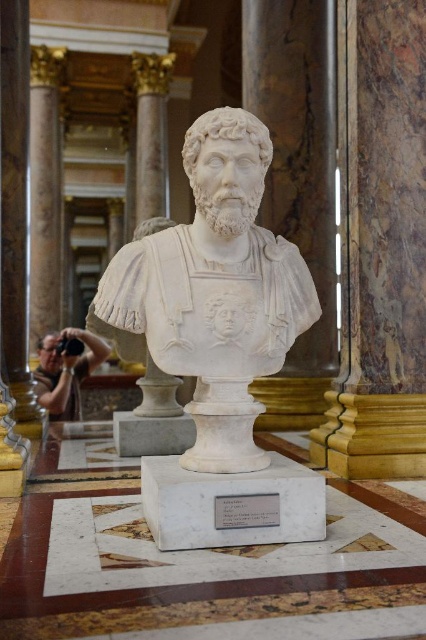
Is white marble bust at center smaller than marble column at center?

Incorrect, white marble bust at center is not smaller in size than marble column at center.

Is white marble bust at center wider than marble column at center?

Indeed, white marble bust at center has a greater width compared to marble column at center.

Consider the image. Who is more distant from viewer, (247,442) or (150,58)?

The point (150,58) is more distant.

This screenshot has height=640, width=426. I want to click on white marble bust at center, so click(x=215, y=291).

Does white marble bust at center lie behind matte black camera at lower left?

No.

Which is above, white marble bust at center or matte black camera at lower left?

white marble bust at center is above.

Is point (203, 332) less distant than point (43, 360)?

Yes, point (203, 332) is in front of point (43, 360).

At what (x,y) coordinates should I click in order to perform the action: click on white marble bust at center. Please return your answer as a coordinate pair (x, y). The image size is (426, 640). Looking at the image, I should click on (215, 291).

Does marble column at center have a lesser width compared to matte black camera at lower left?

Yes.

Does marble column at center appear over matte black camera at lower left?

Correct, marble column at center is located above matte black camera at lower left.

This screenshot has height=640, width=426. I want to click on marble column at center, so click(150, 138).

At what (x,y) coordinates should I click in order to perform the action: click on marble column at center. Please return your answer as a coordinate pair (x, y). Looking at the image, I should click on (150, 138).